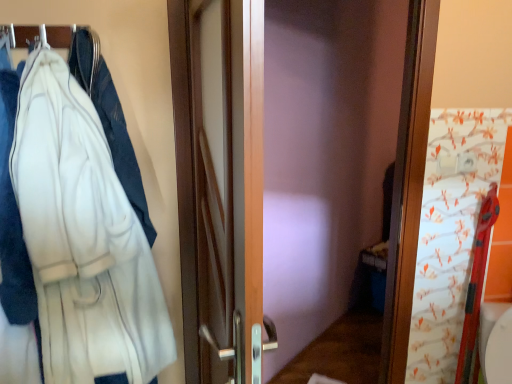
Question: Considering the positions of metallic silver hanger at upper left and white fleece bathrobe at left in the image, is metallic silver hanger at upper left wider or thinner than white fleece bathrobe at left?

Choices:
 (A) thin
 (B) wide

Answer: (A)

Question: Considering the positions of metallic silver hanger at upper left and white fleece bathrobe at left in the image, is metallic silver hanger at upper left taller or shorter than white fleece bathrobe at left?

Choices:
 (A) tall
 (B) short

Answer: (B)

Question: Estimate the real-world distances between objects in this image. Which object is closer to the white fleece jacket at left?

Choices:
 (A) white fleece bathrobe at left
 (B) metallic silver hanger at upper left

Answer: (A)

Question: Based on their relative distances, which object is nearer to the white fleece jacket at left?

Choices:
 (A) white fleece bathrobe at left
 (B) metallic silver hanger at upper left

Answer: (A)